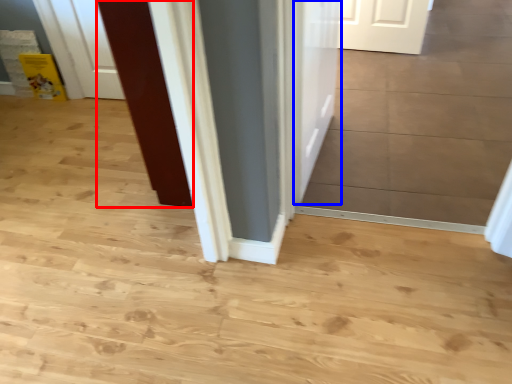
Question: Which point is further to the camera, door (highlighted by a red box) or door (highlighted by a blue box)?

Choices:
 (A) door
 (B) door

Answer: (A)